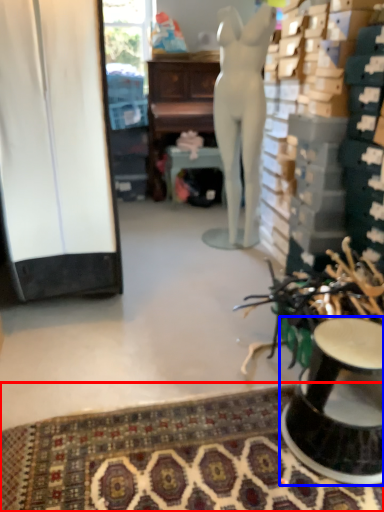
Question: Among these objects, which one is nearest to the camera, mat (highlighted by a red box) or furniture (highlighted by a blue box)?

Choices:
 (A) mat
 (B) furniture

Answer: (A)